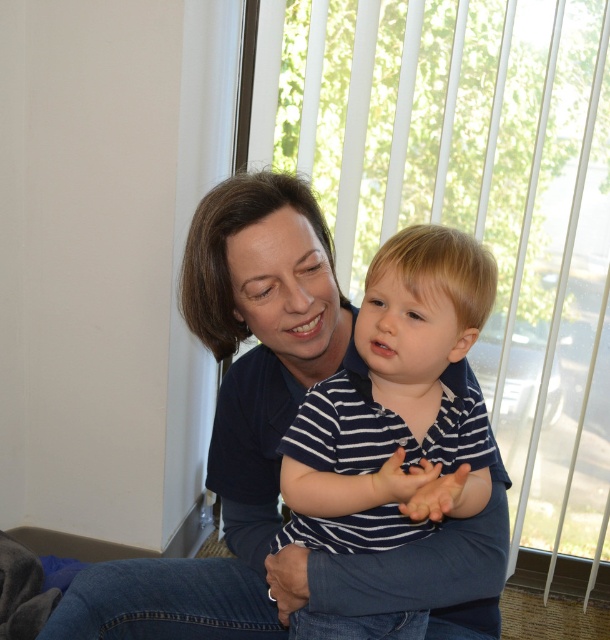
What are the coordinates of the matte blue shirt at center?

The matte blue shirt at center is located at point (278, 452).

You are a photographer setting up a photo shoot. You have two shirts, a matte blue shirt at center and a striped cotton shirt at center. The client wants to know which shirt will cover more vertical space in the frame. Based on the scene description, which one should they choose?

The matte blue shirt at center is much taller than the striped cotton shirt at center, so it will cover more vertical space in the frame.